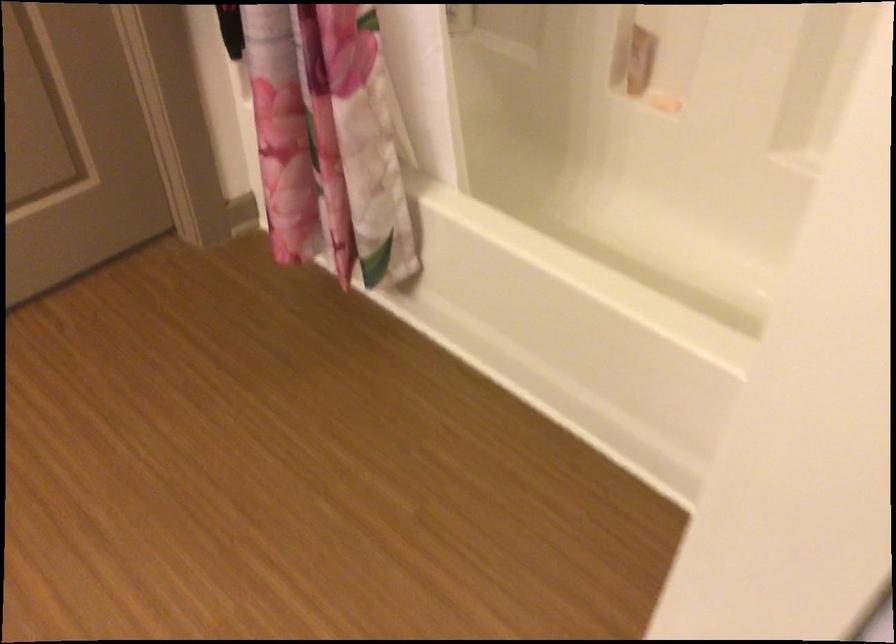
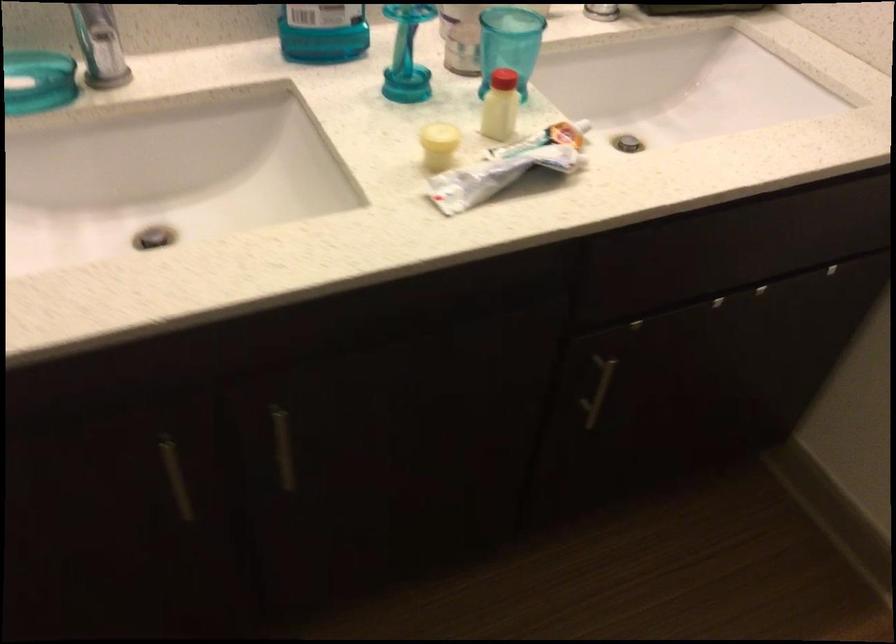
The images are taken continuously from a first-person perspective. In which direction is your viewpoint rotating?

The rotation direction of the camera is left-down.